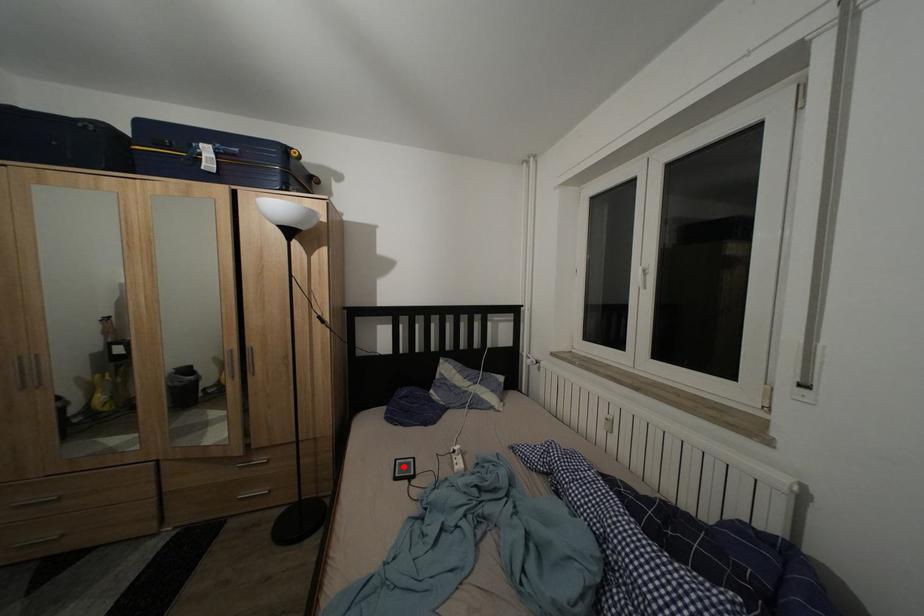
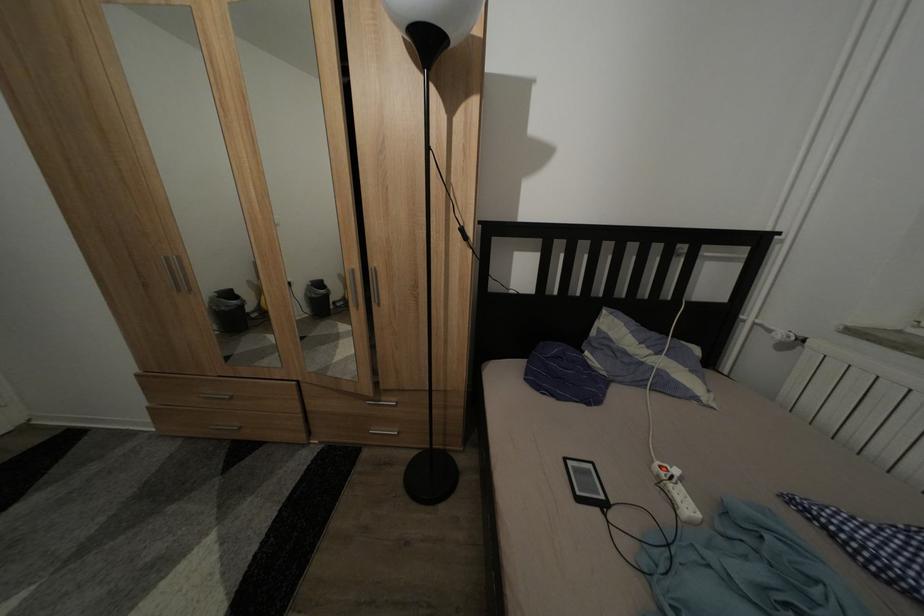
The point at the highlighted location is marked in the first image. Where is the corresponding point in the second image?

(573, 466)